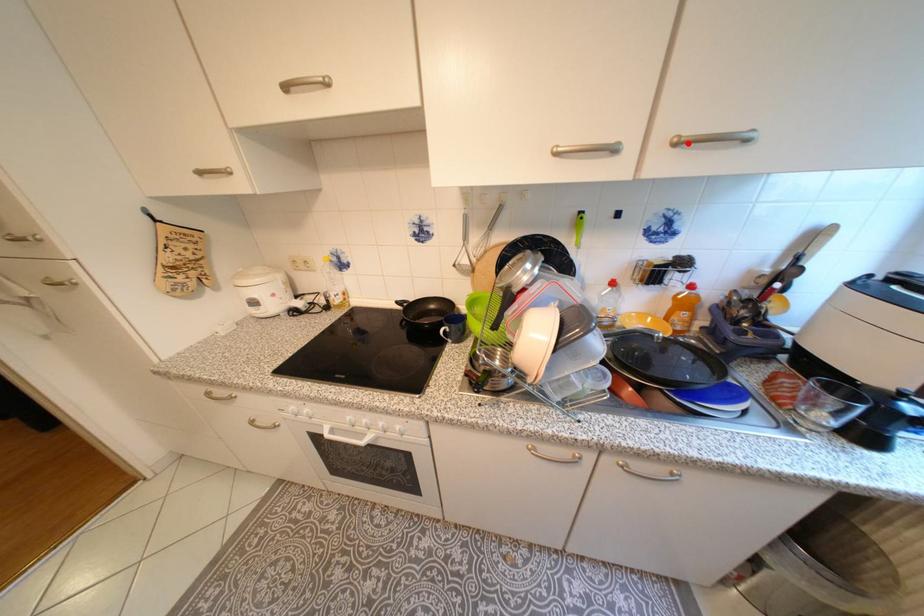
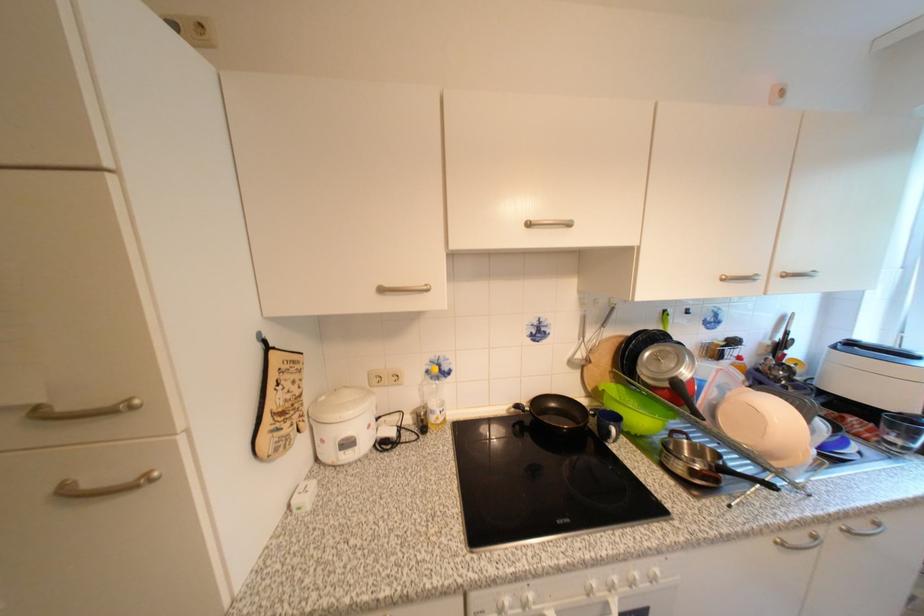
Locate, in the second image, the point that corresponds to the highlighted location in the first image.

(796, 277)